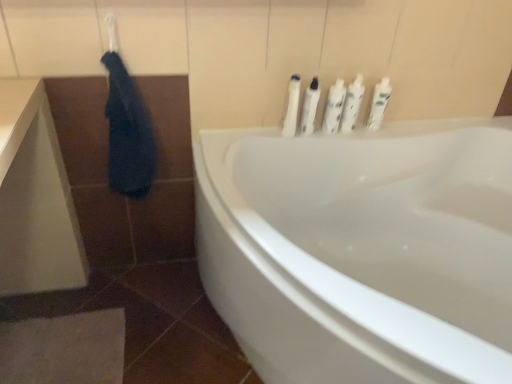
Question: Is white plastic bottles at upper center, positioned as the third toiletry in right-to-left order, wider or thinner than dark blue fabric at upper left?

Choices:
 (A) wide
 (B) thin

Answer: (B)

Question: Is white plastic bottles at upper center, positioned as the third toiletry in right-to-left order, taller or shorter than dark blue fabric at upper left?

Choices:
 (A) short
 (B) tall

Answer: (A)

Question: Estimate the real-world distances between objects in this image. Which object is farther from the white plastic bottles at upper right, the 1th toiletry viewed from the left?

Choices:
 (A) white glossy bottles at upper right, the fifth toiletry from the left
 (B) dark blue fabric at upper left
 (C) white glossy bottles at upper center, the fourth toiletry in the left-to-right sequence
 (D) white glossy bottles at upper center, arranged as the second toiletry when viewed from the left
 (E) white plastic bottles at upper center, positioned as the third toiletry in right-to-left order

Answer: (B)

Question: Which is nearer to the white glossy bottles at upper right, the fifth toiletry from the left?

Choices:
 (A) white plastic bottles at upper center, positioned as the third toiletry in right-to-left order
 (B) white glossy bottles at upper center, positioned as the second toiletry in right-to-left order
 (C) white glossy bottles at upper center, arranged as the second toiletry when viewed from the left
 (D) white glossy bathtub at center
 (E) dark blue fabric at upper left

Answer: (B)